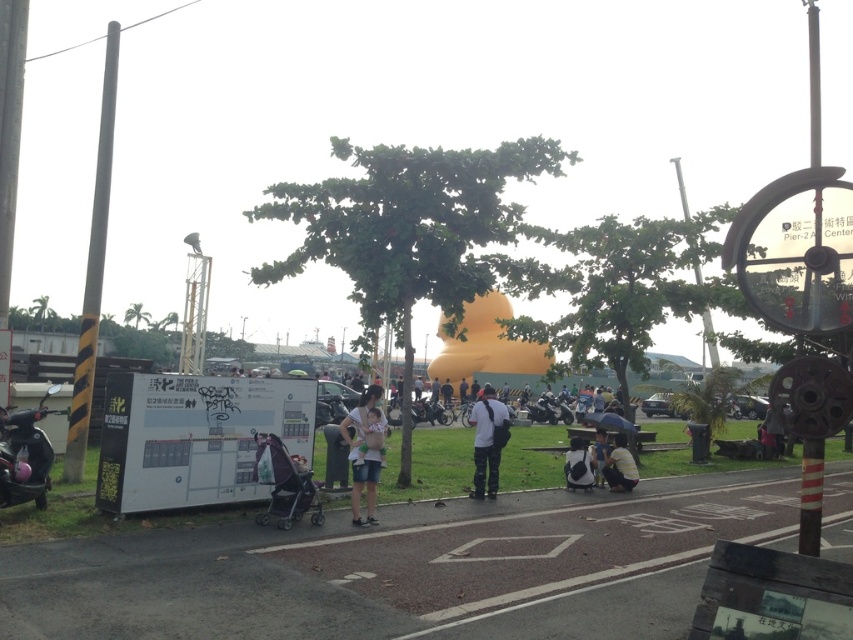
Does matte black scooter at left appear on the left side of dark gray fabric umbrella at center?

Correct, you'll find matte black scooter at left to the left of dark gray fabric umbrella at center.

Describe the element at coordinates (25, 454) in the screenshot. I see `matte black scooter at left` at that location.

The width and height of the screenshot is (853, 640). What are the coordinates of `matte black scooter at left` in the screenshot? It's located at (25, 454).

Between point (367, 392) and point (575, 445), which one is positioned behind?

Point (575, 445)

Between point (367, 484) and point (576, 468), which one is positioned behind?

Point (576, 468)

Locate an element on the screen. The image size is (853, 640). denim shorts at center is located at coordinates (364, 451).

Which is behind, point (473, 474) or point (440, 394)?

The point (440, 394) is behind.

Is dark blue jeans at center above matte white shirt at center?

Indeed, dark blue jeans at center is positioned over matte white shirt at center.

Describe the element at coordinates (486, 442) in the screenshot. This screenshot has height=640, width=853. I see `dark blue jeans at center` at that location.

You are a GUI agent. You are given a task and a screenshot of the screen. Output one action in this format:
    pyautogui.click(x=<x>, y=<y>)
    Task: Click on the dark blue jeans at center
    This screenshot has height=640, width=853.
    Given the screenshot: What is the action you would take?
    pyautogui.click(x=486, y=442)